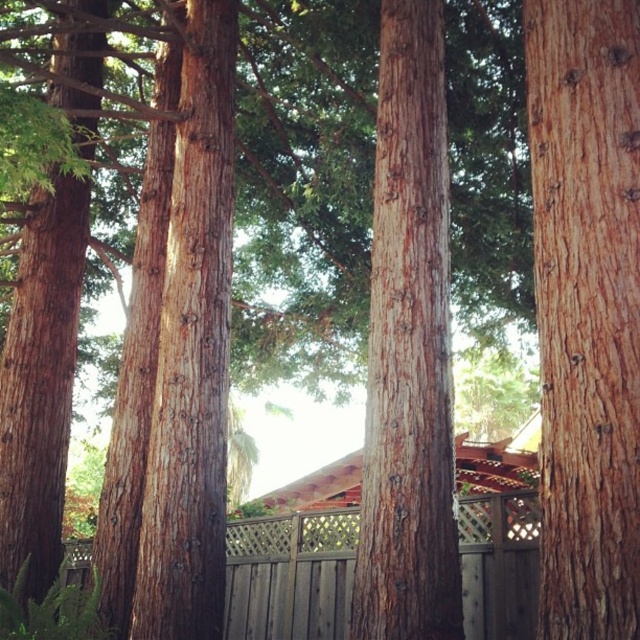
You are an artist sketching the scene and want to capture the sizes of the objects accurately. Which object should you draw first if you want to start with the larger one between the smooth brown bark at right and the brown textured wood at center?

The brown textured wood at center is larger than the smooth brown bark at right, so you should draw the brown textured wood at center first.

You are a painter standing at the edge of the forest, holding a 3.5 feet wide canvas. You want to paint both the smooth brown bark at right and the brown textured wood at center on the same canvas. Can you fit both objects on your canvas without overlapping them?

The distance between the smooth brown bark at right and the brown textured wood at center is 3.93 feet. Since your canvas is only 3.5 feet wide, you cannot fit both objects without overlapping them because the distance between them is greater than the canvas width.

You are planning to place a 1.2 meter wide bench between the smooth brown tree trunk at center and the wooden lattice fence at center. Based on the scene description, will the bench fit between them?

The smooth brown tree trunk at center is narrower than the wooden lattice fence at center. However, the exact distance between them isn not specified. Without knowing the space between the two objects, it is impossible to determine if the 1.2 meter wide bench will fit.